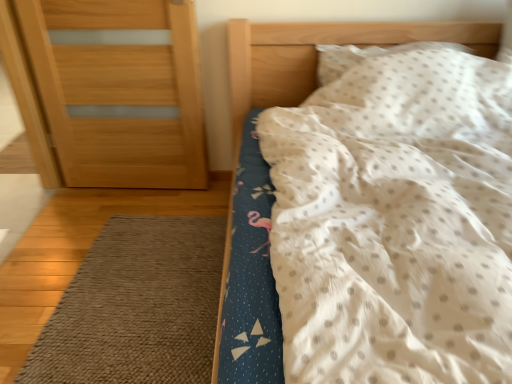
Question: From a real-world perspective, is wooden door at left on brown textured rug at lower left?

Choices:
 (A) yes
 (B) no

Answer: (A)

Question: Would you say wooden door at left is outside brown textured rug at lower left?

Choices:
 (A) yes
 (B) no

Answer: (A)

Question: Does wooden door at left have a greater width compared to brown textured rug at lower left?

Choices:
 (A) yes
 (B) no

Answer: (B)

Question: Considering the relative positions of wooden door at left and brown textured rug at lower left in the image provided, is wooden door at left to the left of brown textured rug at lower left from the viewer's perspective?

Choices:
 (A) no
 (B) yes

Answer: (B)

Question: Is wooden door at left behind brown textured rug at lower left?

Choices:
 (A) no
 (B) yes

Answer: (B)

Question: Is wooden door at left closer to the viewer compared to brown textured rug at lower left?

Choices:
 (A) no
 (B) yes

Answer: (A)

Question: Could you tell me if wooden door at left is turned towards white dotted pillow at upper right?

Choices:
 (A) no
 (B) yes

Answer: (A)

Question: Is wooden door at left thinner than white dotted pillow at upper right?

Choices:
 (A) no
 (B) yes

Answer: (B)

Question: Is the position of wooden door at left more distant than that of white dotted pillow at upper right?

Choices:
 (A) no
 (B) yes

Answer: (A)

Question: From the image's perspective, is wooden door at left over white dotted pillow at upper right?

Choices:
 (A) no
 (B) yes

Answer: (A)

Question: From the image's perspective, is wooden door at left under white dotted pillow at upper right?

Choices:
 (A) yes
 (B) no

Answer: (A)

Question: Does wooden door at left appear on the left side of white dotted pillow at upper right?

Choices:
 (A) no
 (B) yes

Answer: (B)

Question: Can you confirm if brown textured rug at lower left is taller than white dotted fabric at upper right?

Choices:
 (A) no
 (B) yes

Answer: (A)